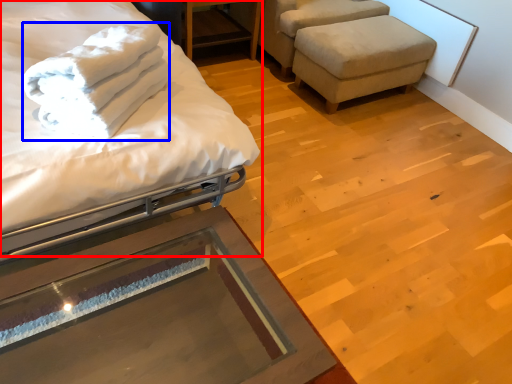
Question: Which object appears closest to the camera in this image, bed (highlighted by a red box) or bath towel (highlighted by a blue box)?

Choices:
 (A) bed
 (B) bath towel

Answer: (A)